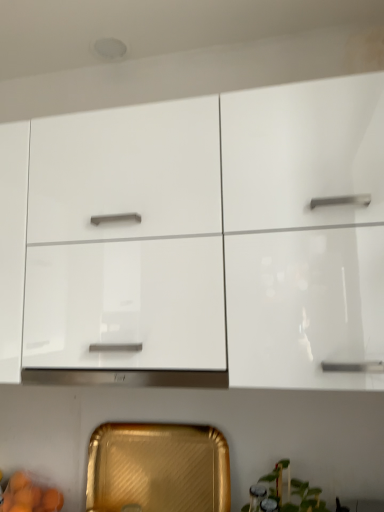
Question: Considering the relative sizes of white glossy cabinet at upper center, placed as the 2th cabinetry when sorted from bottom to top, and green glossy plant at lower right in the image provided, is white glossy cabinet at upper center, placed as the 2th cabinetry when sorted from bottom to top, thinner than green glossy plant at lower right?

Choices:
 (A) no
 (B) yes

Answer: (A)

Question: Does white glossy cabinet at upper center, which ranks as the 1th cabinetry in top-to-bottom order, have a greater height compared to green glossy plant at lower right?

Choices:
 (A) no
 (B) yes

Answer: (B)

Question: From a real-world perspective, is white glossy cabinet at upper center, which ranks as the 1th cabinetry in top-to-bottom order, on top of green glossy plant at lower right?

Choices:
 (A) yes
 (B) no

Answer: (A)

Question: Is white glossy cabinet at upper center, placed as the 2th cabinetry when sorted from bottom to top, not near green glossy plant at lower right?

Choices:
 (A) no
 (B) yes

Answer: (A)

Question: Can you confirm if white glossy cabinet at upper center, which ranks as the 1th cabinetry in top-to-bottom order, is positioned to the left of green glossy plant at lower right?

Choices:
 (A) yes
 (B) no

Answer: (A)

Question: From the image's perspective, does white glossy cabinet at upper center, which ranks as the 1th cabinetry in top-to-bottom order, appear lower than green glossy plant at lower right?

Choices:
 (A) yes
 (B) no

Answer: (B)

Question: From a real-world perspective, is gold textured tray at lower center, marked as the second cabinetry in a top-to-bottom arrangement, under green glossy plant at lower right?

Choices:
 (A) yes
 (B) no

Answer: (B)

Question: Is green glossy plant at lower right at the back of gold textured tray at lower center, which is the first cabinetry in bottom-to-top order?

Choices:
 (A) yes
 (B) no

Answer: (B)

Question: Is the depth of gold textured tray at lower center, marked as the second cabinetry in a top-to-bottom arrangement, greater than that of green glossy plant at lower right?

Choices:
 (A) yes
 (B) no

Answer: (A)

Question: Is gold textured tray at lower center, which is the first cabinetry in bottom-to-top order, taller than green glossy plant at lower right?

Choices:
 (A) yes
 (B) no

Answer: (A)

Question: Is green glossy plant at lower right inside gold textured tray at lower center, marked as the second cabinetry in a top-to-bottom arrangement?

Choices:
 (A) yes
 (B) no

Answer: (B)

Question: Can you confirm if gold textured tray at lower center, marked as the second cabinetry in a top-to-bottom arrangement, is positioned to the right of green glossy plant at lower right?

Choices:
 (A) yes
 (B) no

Answer: (B)

Question: Is gold textured tray at lower center, marked as the second cabinetry in a top-to-bottom arrangement, positioned beyond the bounds of white glossy cabinet at upper center, placed as the 2th cabinetry when sorted from bottom to top?

Choices:
 (A) no
 (B) yes

Answer: (B)